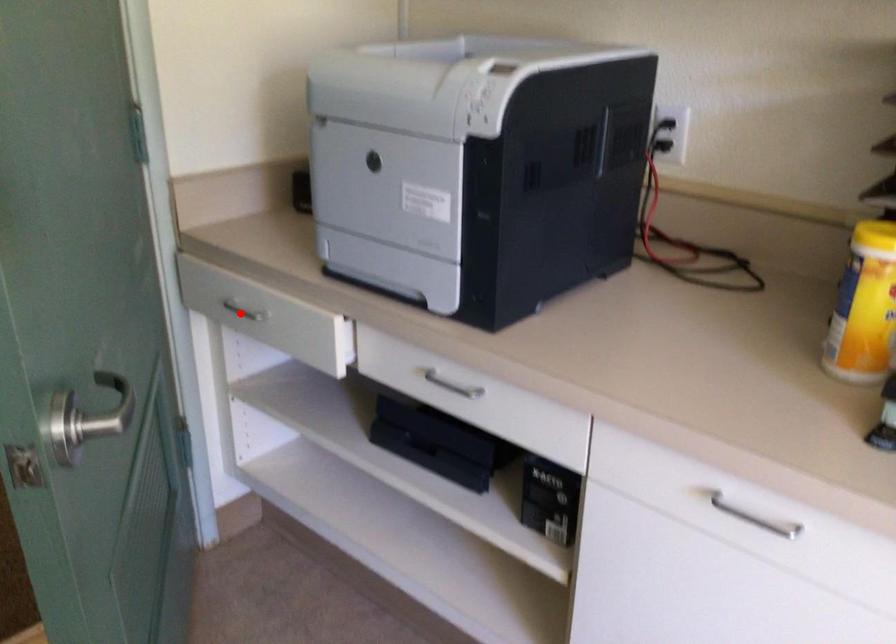
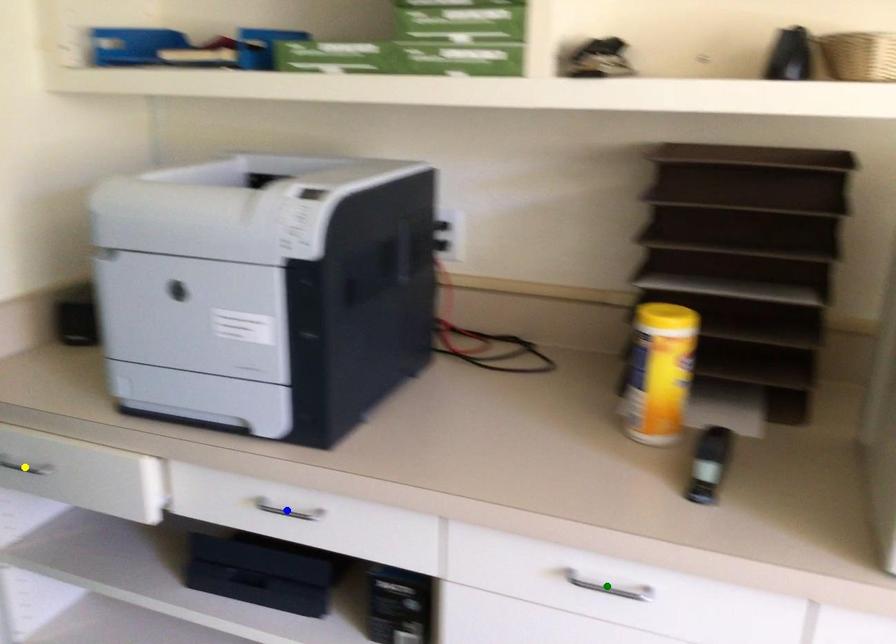
Question: I am providing you with two images of the same scene from different viewpoints. A red point is marked on the first image. You are given multiple points on the second image. Which mark in image 2 goes with the point in image 1?

Choices:
 (A) green point
 (B) blue point
 (C) yellow point

Answer: (C)